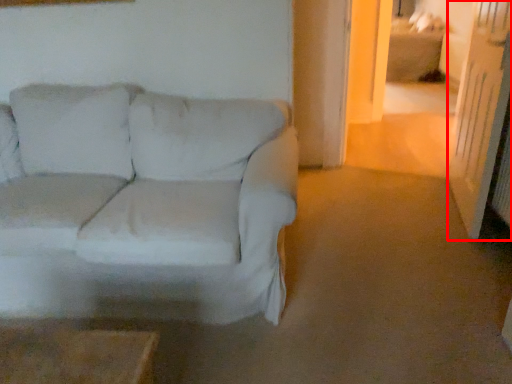
Question: From the image's perspective, what is the correct spatial relationship of glass door (annotated by the red box) in relation to studio couch?

Choices:
 (A) above
 (B) below

Answer: (A)